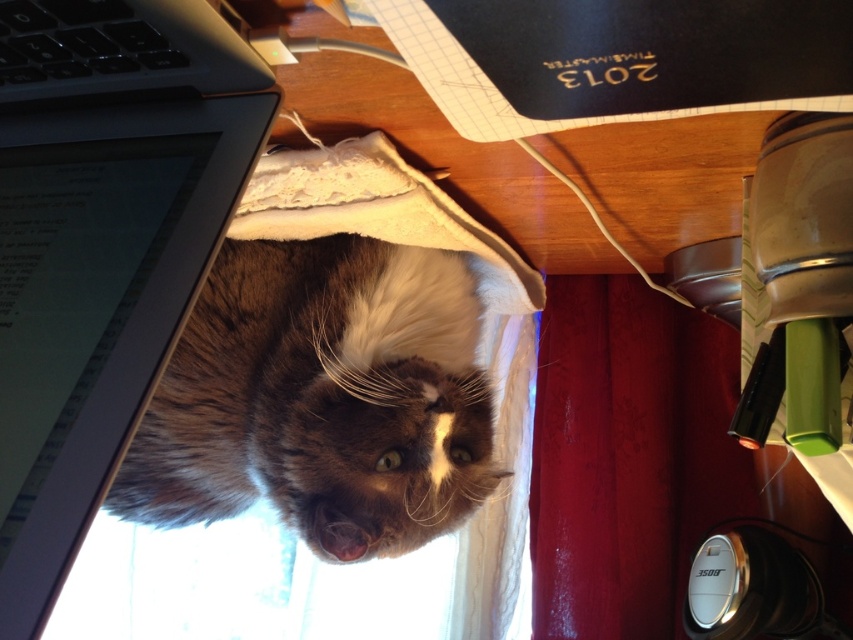
You are organizing the desk and want to place the black plastic keyboard at upper left closer to the edge. Which side should you move it to so it aligns with the black plastic laptop at left?

The black plastic laptop at left is to the right of the black plastic keyboard at upper left, so you should move the black plastic keyboard at upper left to the right to align with the black plastic laptop at left.

You are trying to decide whether to place a new 18 inch wide decorative item on the desk. The desk has the brown fluffy cat at center and the red velvet curtain at lower right. Based on their sizes, which object would require more space horizontally?

The brown fluffy cat at center requires more horizontal space because its width is larger than the red velvet curtain at lower right.

You are a cat owner who wants to place a new toy on the desk. The toy is 10 cm tall. Considering the height of the brown fluffy cat at center and the black plastic keyboard at upper left, will the toy be visible under the cat?

The brown fluffy cat at center is much taller than the black plastic keyboard at upper left. Since the toy is only 10 cm tall, it might be partially or fully obscured by the cat if placed directly under it.